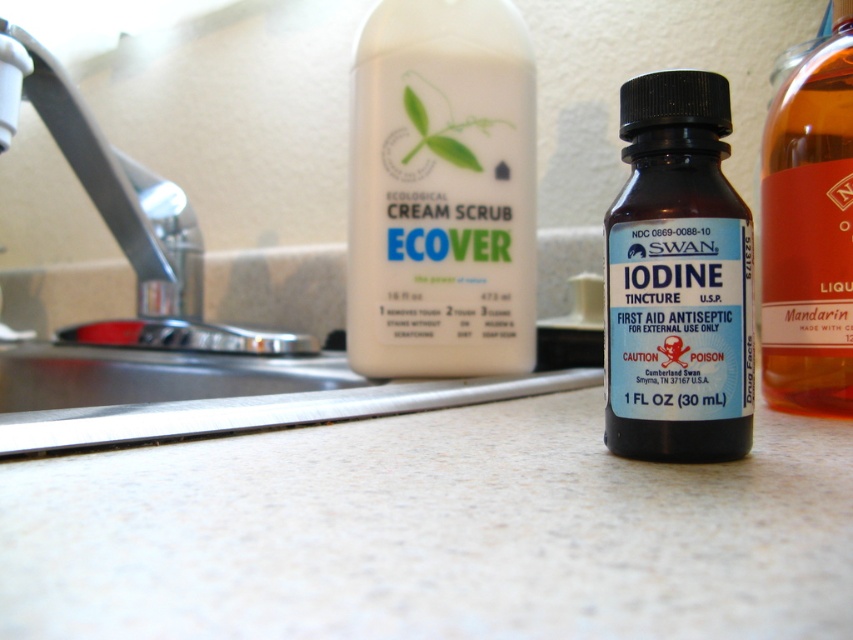
You are organizing items on a kitchen counter and see the white matte cream scrub at center and the amber glass bottle at right. Which item is closer to you?

The white matte cream scrub at center is closer to you because it is in front of the amber glass bottle at right.

You are a photographer setting up a shot of the kitchen countertop. You want to focus on the white matte cream scrub at center while keeping the iodine bottle visible in the background. What should you do to ensure the cream scrub is in focus and the iodine bottle is slightly out of focus?

To ensure the white matte cream scrub at center is in focus and the iodine bottle is slightly out of focus, adjust your camera to a shallow depth of field. Since the white matte cream scrub at center is 33.33 inches from the camera and the iodine bottle is farther away, using a wide aperture will blur the background while keeping the closer object sharp.

You are organizing items on a kitchen countertop. You have a white matte cream scrub at center and an amber glass bottle at right. According to their positions, which item is closer to the left edge of the countertop?

The white matte cream scrub at center is closer to the left edge of the countertop because it is positioned to the left of the amber glass bottle at right.